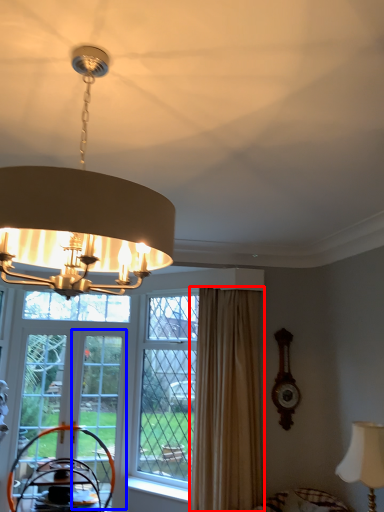
Question: Among these objects, which one is nearest to the camera, curtain (highlighted by a red box) or screen door (highlighted by a blue box)?

Choices:
 (A) curtain
 (B) screen door

Answer: (A)